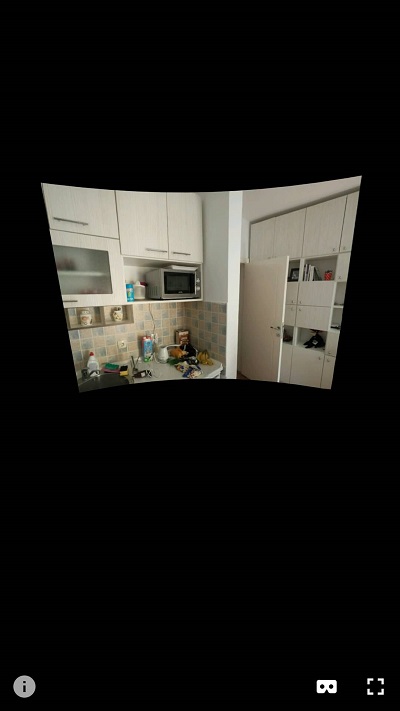
At what (x,y) coordinates should I click in order to perform the action: click on white and tiled wall protruding inside kitchen. Please return your answer as a coordinate pair (x, y). Image resolution: width=400 pixels, height=711 pixels. Looking at the image, I should click on (221, 281).